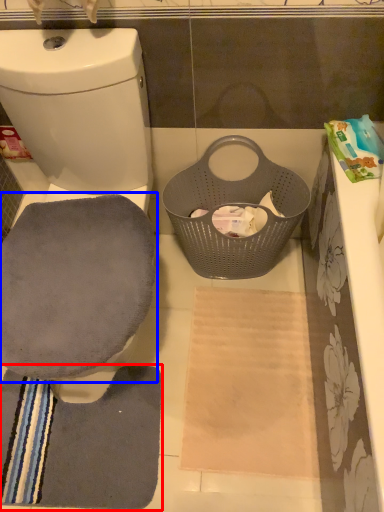
Question: Which point is further to the camera, bath towel (highlighted by a red box) or swivel chair (highlighted by a blue box)?

Choices:
 (A) bath towel
 (B) swivel chair

Answer: (A)